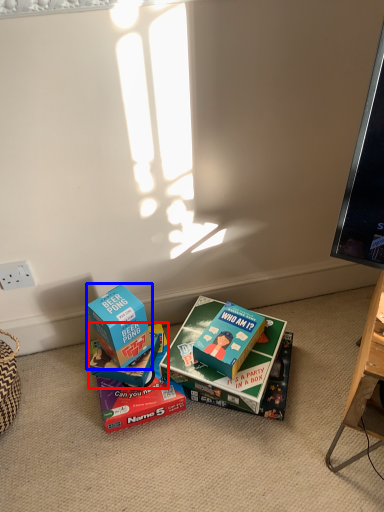
Question: Which point is further to the camera, box (highlighted by a red box) or box (highlighted by a blue box)?

Choices:
 (A) box
 (B) box

Answer: (A)